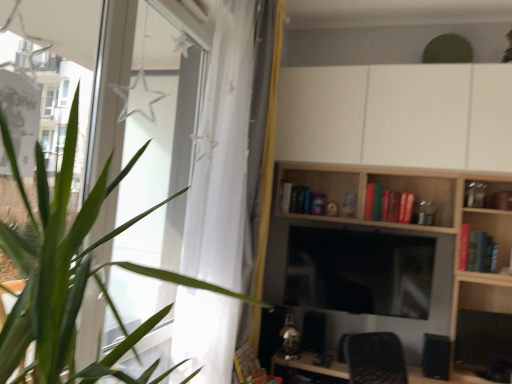
Question: Should I look upward or downward to see matte black monitor at center?

Choices:
 (A) up
 (B) down

Answer: (B)

Question: Is matte black monitor at center thinner than hardcover book at center, the first book in the right-to-left sequence?

Choices:
 (A) yes
 (B) no

Answer: (A)

Question: Considering the relative sizes of matte black monitor at center and hardcover book at center, placed as the third book when sorted from back to front, in the image provided, is matte black monitor at center shorter than hardcover book at center, placed as the third book when sorted from back to front,?

Choices:
 (A) no
 (B) yes

Answer: (A)

Question: Is matte black monitor at center bigger than hardcover book at center, the first book viewed from the front?

Choices:
 (A) yes
 (B) no

Answer: (A)

Question: Considering the relative sizes of matte black monitor at center and hardcover book at center, the first book in the right-to-left sequence, in the image provided, is matte black monitor at center wider than hardcover book at center, the first book in the right-to-left sequence,?

Choices:
 (A) yes
 (B) no

Answer: (B)

Question: From a real-world perspective, is matte black monitor at center below hardcover book at center, placed as the third book when sorted from back to front?

Choices:
 (A) yes
 (B) no

Answer: (A)

Question: Can you confirm if matte black monitor at center is positioned to the right of hardcover book at center, the first book viewed from the front?

Choices:
 (A) no
 (B) yes

Answer: (A)

Question: Can you confirm if white matte cabinet at upper center is shorter than green leafy plant at left?

Choices:
 (A) yes
 (B) no

Answer: (A)

Question: Does white matte cabinet at upper center appear on the left side of green leafy plant at left?

Choices:
 (A) no
 (B) yes

Answer: (A)

Question: Is green leafy plant at left at the back of white matte cabinet at upper center?

Choices:
 (A) yes
 (B) no

Answer: (B)

Question: From the image's perspective, does white matte cabinet at upper center appear lower than green leafy plant at left?

Choices:
 (A) yes
 (B) no

Answer: (B)

Question: Does white matte cabinet at upper center have a larger size compared to green leafy plant at left?

Choices:
 (A) no
 (B) yes

Answer: (B)

Question: Does white matte cabinet at upper center lie behind green leafy plant at left?

Choices:
 (A) yes
 (B) no

Answer: (A)

Question: Considering the relative sizes of green leafy plant at left and white sheer curtain at left in the image provided, is green leafy plant at left smaller than white sheer curtain at left?

Choices:
 (A) yes
 (B) no

Answer: (B)